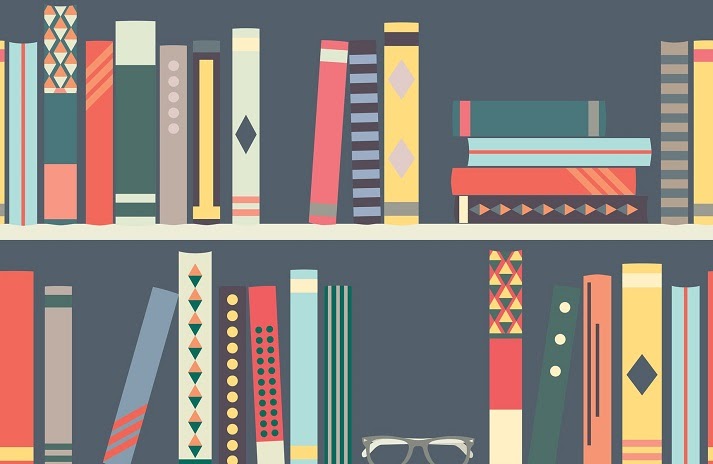
I want to click on books lying on side, so click(x=563, y=112), click(x=557, y=152), click(x=553, y=186), click(x=553, y=206).